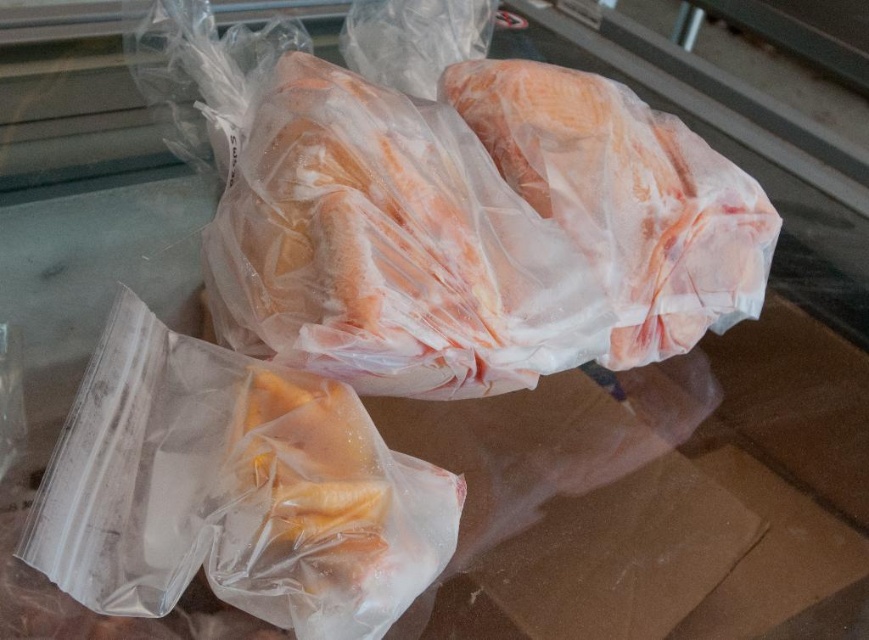
You are a grocery store employee who needs to arrange these items on a shelf. The shelf has a width of 24 inches. If you place the translucent plastic bag at lower left and the translucent plastic chicken at center on the shelf, will they fit side by side without overlapping?

The translucent plastic bag at lower left is 20.41 inches from the translucent plastic chicken at center. Since the shelf is 24 inches wide, placing them side by side would require a total width of at least 20.41 inches. However, the exact widths of the items themselves are not provided, so we cannot confirm if their combined width exceeds the shelf space. Additional measurements are needed.

You are a delivery person who needs to pick up the two plastic bags from the refrigerated display case. The first bag is at point (130,524) and the second is at point (599,262). Which point should you reach for first to minimize bending?

You should reach for point (130,524) first because it is closer to the camera, meaning it is nearer to you and requires less bending compared to point (599,262) which is further back.

You are a store employee organizing items on a shelf. You have to place the translucent plastic bag at lower left and the translucent plastic chicken at center. According to the current arrangement, which item should you move to the right to make space for another item?

The translucent plastic bag at lower left is to the left of the translucent plastic chicken at center. To make space for another item, you should move the translucent plastic bag at lower left to the right so that it is no longer blocking the area to its right.